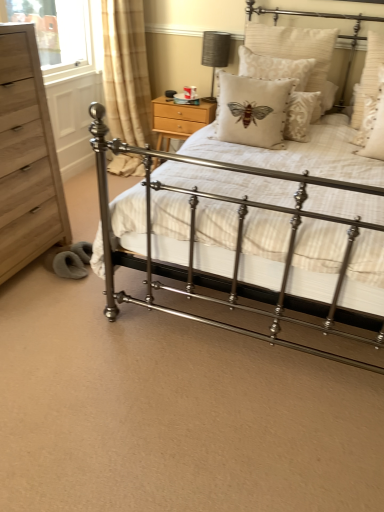
What are the coordinates of `beige plaid curtain at upper left` in the screenshot? It's located at (126, 72).

Find the location of a particular element. This screenshot has width=384, height=512. white textured pillow at upper right, which is the fifth pillow in left-to-right order is located at coordinates (368, 76).

This screenshot has height=512, width=384. Identify the location of wooden nightstand at upper center. (179, 119).

Which object is wider, white textured pillow at upper right, placed as the 2th pillow when sorted from right to left, or beige textured pillow at upper right, the fourth pillow in the right-to-left sequence?

Wider between the two is white textured pillow at upper right, placed as the 2th pillow when sorted from right to left.

Is white textured pillow at upper right, placed as the 2th pillow when sorted from right to left, turned away from beige textured pillow at upper right, arranged as the 2th pillow when viewed from the left?

No, beige textured pillow at upper right, arranged as the 2th pillow when viewed from the left, is not at the back of white textured pillow at upper right, placed as the 2th pillow when sorted from right to left.

Consider the image. Which object is positioned more to the right, white textured pillow at upper right, placed as the 2th pillow when sorted from right to left, or beige textured pillow at upper right, the fourth pillow in the right-to-left sequence?

From the viewer's perspective, white textured pillow at upper right, placed as the 2th pillow when sorted from right to left, appears more on the right side.

Consider the image. Is white textured pillow at upper right, placed as the 2th pillow when sorted from right to left, positioned beyond the bounds of beige textured pillow at upper right, arranged as the 2th pillow when viewed from the left?

Yes, white textured pillow at upper right, placed as the 2th pillow when sorted from right to left, is not within beige textured pillow at upper right, arranged as the 2th pillow when viewed from the left.

Between white textured pillow at upper right, which ranks as the 1th pillow in right-to-left order, and metallic iron bed at center, which one is positioned behind?

white textured pillow at upper right, which ranks as the 1th pillow in right-to-left order, is further from the camera.

From the picture: Measure the distance between white textured pillow at upper right, which is the fifth pillow in left-to-right order, and metallic iron bed at center.

white textured pillow at upper right, which is the fifth pillow in left-to-right order, is 3.51 feet from metallic iron bed at center.

Is white textured pillow at upper right, which is the fifth pillow in left-to-right order, wider or thinner than metallic iron bed at center?

Considering their sizes, white textured pillow at upper right, which is the fifth pillow in left-to-right order, looks slimmer than metallic iron bed at center.

From the image's perspective, is white textured pillow at upper right, which ranks as the 1th pillow in right-to-left order, located above metallic iron bed at center?

Indeed, from the image's perspective, white textured pillow at upper right, which ranks as the 1th pillow in right-to-left order, is shown above metallic iron bed at center.

From a real-world perspective, is beige plaid curtain at upper left positioned above or below beige textured pillow with bee design at center, arranged as the third pillow when viewed from the right?

beige plaid curtain at upper left is situated lower than beige textured pillow with bee design at center, arranged as the third pillow when viewed from the right, in the real world.

Between beige plaid curtain at upper left and beige textured pillow with bee design at center, arranged as the third pillow when viewed from the right, which one has more height?

Standing taller between the two is beige plaid curtain at upper left.

Which of these two, beige plaid curtain at upper left or beige textured pillow with bee design at center, arranged as the third pillow when viewed from the right, is smaller?

beige textured pillow with bee design at center, arranged as the third pillow when viewed from the right.

Based on the photo, considering the relative positions of beige textured pillow with bee design at center, arranged as the third pillow when viewed from the right, and wooden nightstand at upper center in the image provided, is beige textured pillow with bee design at center, arranged as the third pillow when viewed from the right, to the left or to the right of wooden nightstand at upper center?

From the image, it's evident that beige textured pillow with bee design at center, arranged as the third pillow when viewed from the right, is to the right of wooden nightstand at upper center.

Is wooden nightstand at upper center completely or partially inside beige textured pillow with bee design at center, which appears as the 3th pillow when viewed from the left?

No, beige textured pillow with bee design at center, which appears as the 3th pillow when viewed from the left, does not contain wooden nightstand at upper center.

Can you confirm if beige textured pillow with bee design at center, arranged as the third pillow when viewed from the right, is shorter than wooden nightstand at upper center?

No.

Does point (269, 29) come behind point (207, 114)?

No.

Is white textured pillow with moth design at center, which appears as the first pillow when viewed from the left, to the right of beige plaid curtain at upper left from the viewer's perspective?

Correct, you'll find white textured pillow with moth design at center, which appears as the first pillow when viewed from the left, to the right of beige plaid curtain at upper left.

Considering the sizes of white textured pillow with moth design at center, which appears as the first pillow when viewed from the left, and beige plaid curtain at upper left in the image, is white textured pillow with moth design at center, which appears as the first pillow when viewed from the left, wider or thinner than beige plaid curtain at upper left?

Considering their sizes, white textured pillow with moth design at center, which appears as the first pillow when viewed from the left, looks slimmer than beige plaid curtain at upper left.

Locate an element on the screen. The width and height of the screenshot is (384, 512). pillow that is the 4th object located below the beige plaid curtain at upper left (from the image's perspective) is located at coordinates (252, 110).

Between white textured pillow with moth design at center, marked as the fifth pillow in a right-to-left arrangement, and beige plaid curtain at upper left, which one has larger size?

With larger size is beige plaid curtain at upper left.

Find the location of a particular element. The width and height of the screenshot is (384, 512). table lamp above the white textured pillow at upper right, which is the fifth pillow in left-to-right order (from a real-world perspective) is located at coordinates (215, 54).

Looking at this image, is white textured pillow at upper right, which ranks as the 1th pillow in right-to-left order, positioned behind matte gray fabric table lamp at upper center?

No, it is not.

Is white textured pillow at upper right, which ranks as the 1th pillow in right-to-left order, positioned with its back to matte gray fabric table lamp at upper center?

No, white textured pillow at upper right, which ranks as the 1th pillow in right-to-left order, is not facing the opposite direction of matte gray fabric table lamp at upper center.

Is metallic iron bed at center situated inside beige textured pillow with bee design at center, arranged as the third pillow when viewed from the right, or outside?

metallic iron bed at center is outside beige textured pillow with bee design at center, arranged as the third pillow when viewed from the right.

Is the position of metallic iron bed at center more distant than that of beige textured pillow with bee design at center, arranged as the third pillow when viewed from the right?

No, it is not.

Between point (172, 209) and point (320, 50), which one is positioned in front?

Point (172, 209)

Is metallic iron bed at center placed right next to beige textured pillow with bee design at center, arranged as the third pillow when viewed from the right?

No.

The image size is (384, 512). What are the coordinates of `the 4th pillow directly beneath the beige textured pillow at upper right, the fourth pillow in the right-to-left sequence (from a real-world perspective)` in the screenshot? It's located at (375, 131).

At what (x,y) coordinates should I click in order to perform the action: click on pillow that is the 3rd one when counting upward from the metallic iron bed at center (from the image's perspective). Please return your answer as a coordinate pair (x, y). Looking at the image, I should click on (368, 76).

Estimate the real-world distances between objects in this image. Which object is further from white textured pillow at upper right, which is the fifth pillow in left-to-right order, beige textured pillow with bee design at center, which appears as the 3th pillow when viewed from the left, or beige textured pillow at upper right, arranged as the 2th pillow when viewed from the left?

The object further to white textured pillow at upper right, which is the fifth pillow in left-to-right order, is beige textured pillow at upper right, arranged as the 2th pillow when viewed from the left.

Consider the image. Which object lies nearer to the anchor point metallic iron bed at center, white textured pillow at upper right, which ranks as the 1th pillow in right-to-left order, or light brown wood chest of drawers at left?

The object closer to metallic iron bed at center is light brown wood chest of drawers at left.

Which object lies further to the anchor point beige plaid curtain at upper left, white textured pillow at upper right, which ranks as the 1th pillow in right-to-left order, or white textured pillow at upper right, placed as the 2th pillow when sorted from right to left?

white textured pillow at upper right, placed as the 2th pillow when sorted from right to left, lies further to beige plaid curtain at upper left than the other object.

Estimate the real-world distances between objects in this image. Which object is closer to beige plaid curtain at upper left, white textured pillow with moth design at center, which appears as the first pillow when viewed from the left, or metallic iron bed at center?

Based on the image, white textured pillow with moth design at center, which appears as the first pillow when viewed from the left, appears to be nearer to beige plaid curtain at upper left.

Based on their spatial positions, is matte gray fabric table lamp at upper center or white textured pillow with moth design at center, marked as the fifth pillow in a right-to-left arrangement, further from white textured pillow at upper right, which ranks as the 1th pillow in right-to-left order?

matte gray fabric table lamp at upper center.

Which object lies further to the anchor point beige textured pillow with bee design at center, which appears as the 3th pillow when viewed from the left, beige plaid curtain at upper left or matte gray fabric table lamp at upper center?

The object further to beige textured pillow with bee design at center, which appears as the 3th pillow when viewed from the left, is beige plaid curtain at upper left.

Estimate the real-world distances between objects in this image. Which object is closer to beige textured pillow with bee design at center, arranged as the third pillow when viewed from the right, light brown wood chest of drawers at left or white textured pillow at upper right, which is counted as the fourth pillow, starting from the left?

white textured pillow at upper right, which is counted as the fourth pillow, starting from the left, is closer to beige textured pillow with bee design at center, arranged as the third pillow when viewed from the right.

Considering their positions, is light brown wood chest of drawers at left positioned closer to matte gray fabric table lamp at upper center than wooden nightstand at upper center?

Among the two, wooden nightstand at upper center is located nearer to matte gray fabric table lamp at upper center.

Image resolution: width=384 pixels, height=512 pixels. Find the location of `table lamp between beige plaid curtain at upper left and beige textured pillow with bee design at center, arranged as the third pillow when viewed from the right`. table lamp between beige plaid curtain at upper left and beige textured pillow with bee design at center, arranged as the third pillow when viewed from the right is located at coordinates (215, 54).

Where is `curtain between light brown wood chest of drawers at left and white textured pillow at upper right, which is the fifth pillow in left-to-right order, in the horizontal direction`? curtain between light brown wood chest of drawers at left and white textured pillow at upper right, which is the fifth pillow in left-to-right order, in the horizontal direction is located at coordinates (126, 72).

Image resolution: width=384 pixels, height=512 pixels. Identify the location of table lamp located between beige plaid curtain at upper left and white textured pillow at upper right, which ranks as the 1th pillow in right-to-left order, in the left-right direction. (215, 54).

Find the location of a particular element. The height and width of the screenshot is (512, 384). curtain between light brown wood chest of drawers at left and white textured pillow with moth design at center, marked as the fifth pillow in a right-to-left arrangement, from left to right is located at coordinates (126, 72).